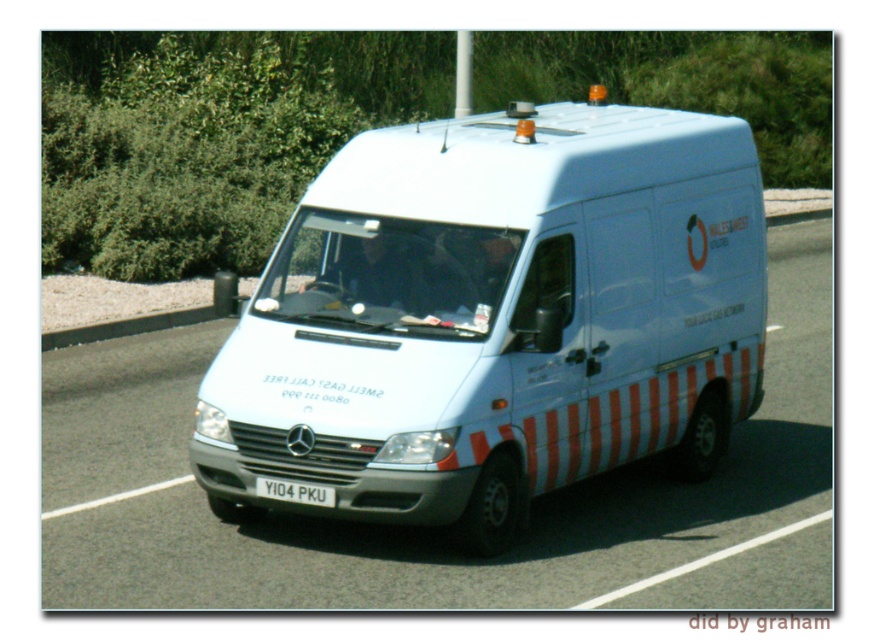
Question: Among these objects, which one is farthest from the camera?

Choices:
 (A) black plastic license plate at center
 (B) white glossy van at center

Answer: (A)

Question: Which point appears closest to the camera in this image?

Choices:
 (A) (431, 314)
 (B) (272, 484)

Answer: (B)

Question: Is white glossy van at center wider than black plastic license plate at center?

Choices:
 (A) yes
 (B) no

Answer: (A)

Question: Does white glossy van at center appear on the left side of black plastic license plate at center?

Choices:
 (A) yes
 (B) no

Answer: (B)

Question: Among these objects, which one is nearest to the camera?

Choices:
 (A) white glossy van at center
 (B) black plastic license plate at center

Answer: (A)

Question: Is white glossy van at center to the left of black plastic license plate at center from the viewer's perspective?

Choices:
 (A) no
 (B) yes

Answer: (A)